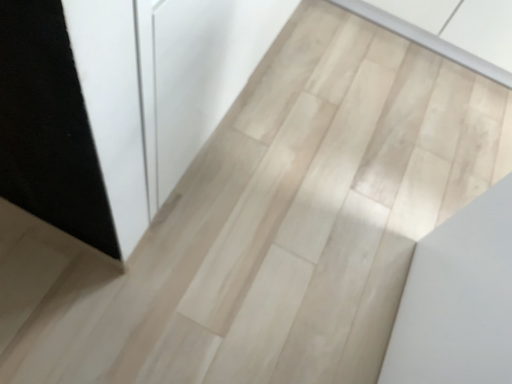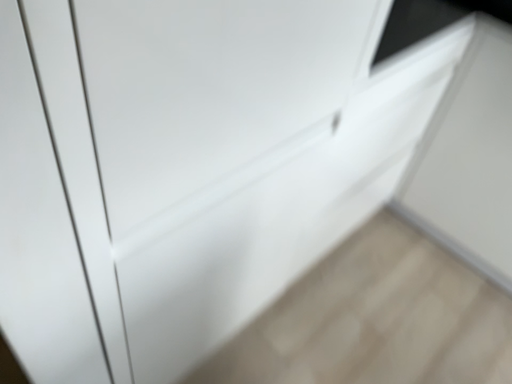
Question: Which way did the camera rotate in the video?

Choices:
 (A) rotated left
 (B) rotated right

Answer: (A)